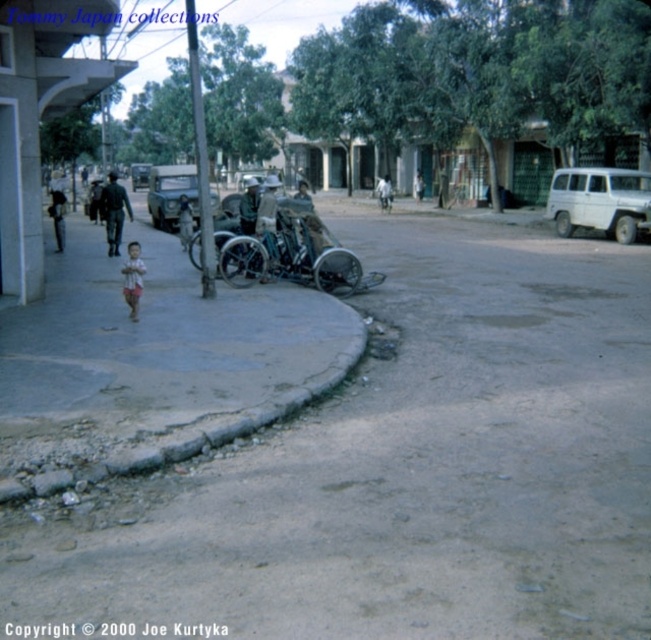
Is gray concrete pavement at lower left positioned at the back of shiny chrome motorcycle at center?

No, gray concrete pavement at lower left is closer to the viewer.

Which is below, gray concrete pavement at lower left or shiny chrome motorcycle at center?

gray concrete pavement at lower left is lower down.

Is point (449, 460) farther from viewer compared to point (380, 180)?

No, it is not.

The width and height of the screenshot is (651, 640). What are the coordinates of `gray concrete pavement at lower left` in the screenshot? It's located at (402, 467).

Which is below, matte black car at center or shiny chrome motorcycle at center?

shiny chrome motorcycle at center is lower down.

Is matte black car at center to the right of shiny chrome motorcycle at center from the viewer's perspective?

No, matte black car at center is not to the right of shiny chrome motorcycle at center.

What do you see at coordinates (171, 195) in the screenshot?
I see `matte black car at center` at bounding box center [171, 195].

The height and width of the screenshot is (640, 651). In order to click on matte black car at center in this screenshot , I will do `click(171, 195)`.

Does gray concrete curb at lower left have a greater height compared to striped shirt child at lower left?

Yes, gray concrete curb at lower left is taller than striped shirt child at lower left.

Based on the photo, between gray concrete curb at lower left and striped shirt child at lower left, which one is positioned higher?

Positioned higher is striped shirt child at lower left.

Is point (169, 401) behind point (128, 252)?

No, it is in front of (128, 252).

Locate an element on the screen. The image size is (651, 640). gray concrete curb at lower left is located at coordinates (154, 364).